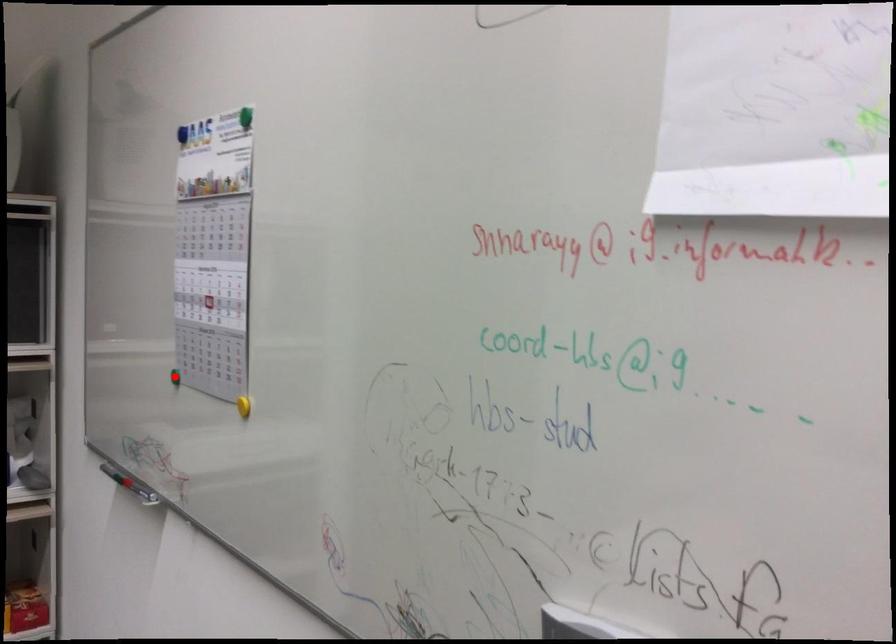
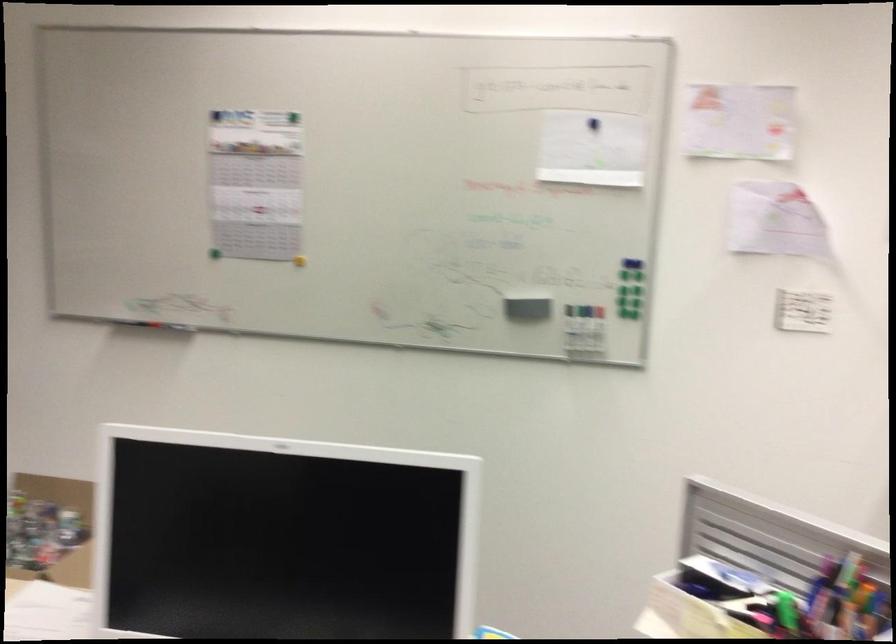
Locate, in the second image, the point that corresponds to the highlighted location in the first image.

(213, 252)